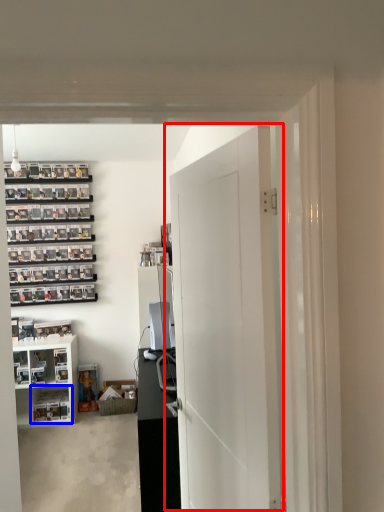
Question: Which of the following is the closest to the observer, door (highlighted by a red box) or shelf (highlighted by a blue box)?

Choices:
 (A) door
 (B) shelf

Answer: (A)